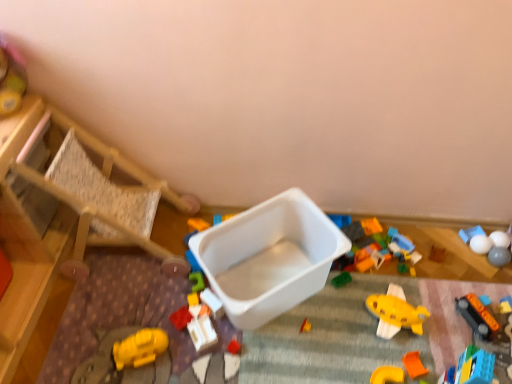
Question: Is smooth plastic container at upper left, which ranks as the 1th toy in left-to-right order, not inside smooth gray ball at lower right, which appears as the 2th toy when viewed from the right?

Choices:
 (A) no
 (B) yes

Answer: (B)

Question: From the image's perspective, is smooth plastic container at upper left, which ranks as the 1th toy in left-to-right order, under smooth gray ball at lower right, the thirteenth toy when ordered from left to right?

Choices:
 (A) no
 (B) yes

Answer: (A)

Question: Is smooth plastic container at upper left, positioned as the fourteenth toy in right-to-left order, directly adjacent to smooth gray ball at lower right, the thirteenth toy when ordered from left to right?

Choices:
 (A) no
 (B) yes

Answer: (A)

Question: Is smooth plastic container at upper left, positioned as the fourteenth toy in right-to-left order, to the left of smooth gray ball at lower right, which appears as the 2th toy when viewed from the right, from the viewer's perspective?

Choices:
 (A) no
 (B) yes

Answer: (B)

Question: Does smooth plastic container at upper left, positioned as the fourteenth toy in right-to-left order, have a larger size compared to smooth gray ball at lower right, the thirteenth toy when ordered from left to right?

Choices:
 (A) no
 (B) yes

Answer: (B)

Question: Is smooth plastic container at upper left, which ranks as the 1th toy in left-to-right order, facing away from smooth gray ball at lower right, which appears as the 2th toy when viewed from the right?

Choices:
 (A) no
 (B) yes

Answer: (A)

Question: From a real-world perspective, is white plastic container at center, which is counted as the 12th toy, starting from the right, positioned over rubberized plastic blocks at center, which is counted as the sixth toy, starting from the left, based on gravity?

Choices:
 (A) no
 (B) yes

Answer: (B)

Question: Does white plastic container at center, the third toy viewed from the left, have a lesser height compared to rubberized plastic blocks at center, which is counted as the sixth toy, starting from the left?

Choices:
 (A) yes
 (B) no

Answer: (B)

Question: Considering the relative sizes of white plastic container at center, which is counted as the 12th toy, starting from the right, and rubberized plastic blocks at center, which is the 9th toy in right-to-left order, in the image provided, is white plastic container at center, which is counted as the 12th toy, starting from the right, thinner than rubberized plastic blocks at center, which is the 9th toy in right-to-left order,?

Choices:
 (A) yes
 (B) no

Answer: (B)

Question: Considering the relative positions of white plastic container at center, which is counted as the 12th toy, starting from the right, and rubberized plastic blocks at center, which is counted as the sixth toy, starting from the left, in the image provided, is white plastic container at center, which is counted as the 12th toy, starting from the right, behind rubberized plastic blocks at center, which is counted as the sixth toy, starting from the left,?

Choices:
 (A) yes
 (B) no

Answer: (B)

Question: Could you tell me if white plastic container at center, which is counted as the 12th toy, starting from the right, is facing rubberized plastic blocks at center, which is the 9th toy in right-to-left order?

Choices:
 (A) yes
 (B) no

Answer: (B)

Question: From the image's perspective, would you say white plastic container at center, the third toy viewed from the left, is shown under rubberized plastic blocks at center, which is the 9th toy in right-to-left order?

Choices:
 (A) no
 (B) yes

Answer: (B)

Question: Is orange matte block at lower right, arranged as the eighth toy when viewed from the left, closer to camera compared to white matte ball at upper right, the third toy when ordered from right to left?

Choices:
 (A) no
 (B) yes

Answer: (B)